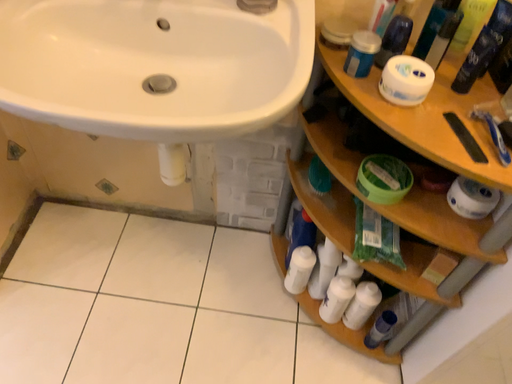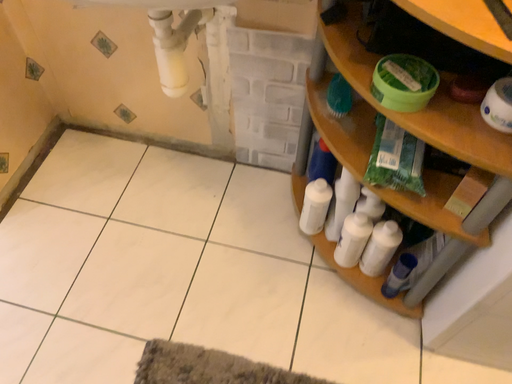
Question: How did the camera likely rotate when shooting the video?

Choices:
 (A) rotated right
 (B) rotated left

Answer: (B)